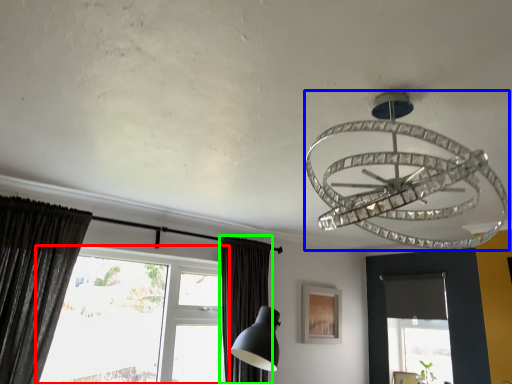
Question: Estimate the real-world distances between objects in this image. Which object is closer to window (highlighted by a red box), lamp (highlighted by a blue box) or curtain (highlighted by a green box)?

Choices:
 (A) lamp
 (B) curtain

Answer: (B)